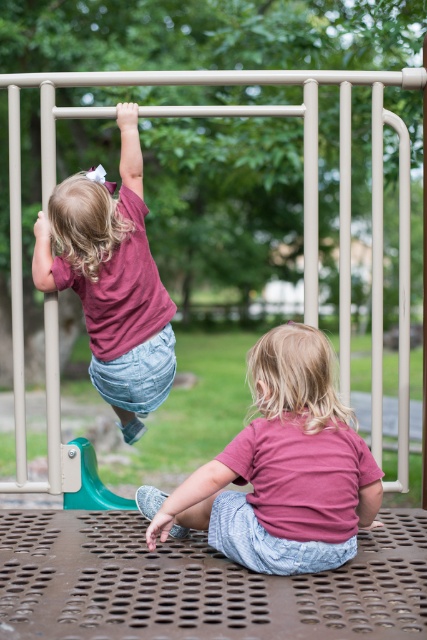
Question: Observing the image, what is the correct spatial positioning of pink fabric shirt at lower center in reference to matte pink shirt at upper left?

Choices:
 (A) below
 (B) above

Answer: (A)

Question: Among these objects, which one is nearest to the camera?

Choices:
 (A) pink fabric shirt at lower center
 (B) matte pink shirt at upper left

Answer: (A)

Question: Among these points, which one is nearest to the camera?

Choices:
 (A) (271, 449)
 (B) (81, 211)

Answer: (A)

Question: Does pink fabric shirt at lower center appear under matte pink shirt at upper left?

Choices:
 (A) no
 (B) yes

Answer: (B)

Question: Does pink fabric shirt at lower center lie in front of matte pink shirt at upper left?

Choices:
 (A) yes
 (B) no

Answer: (A)